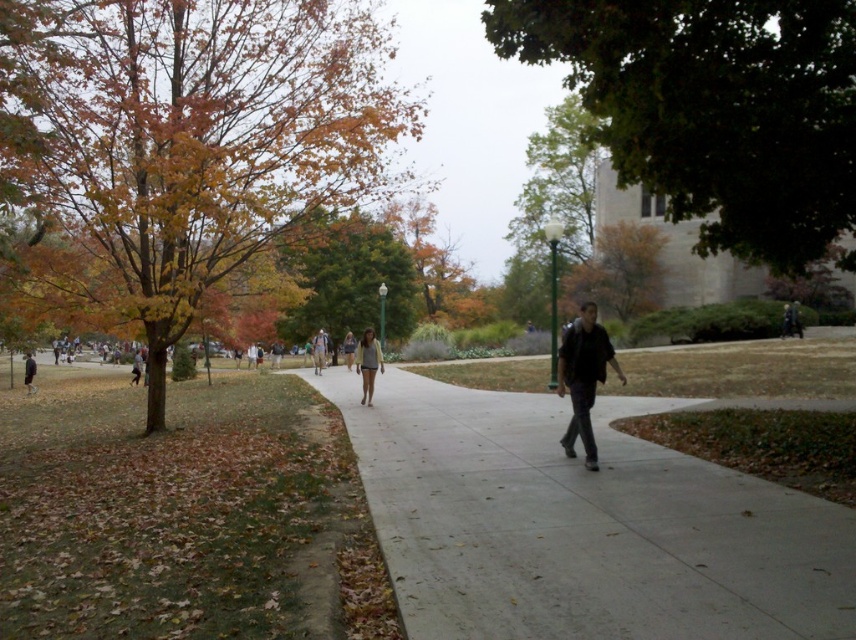
Question: Does dark brown leather jacket at center have a greater width compared to light beige sweater at center?

Choices:
 (A) yes
 (B) no

Answer: (A)

Question: Can you confirm if gray concrete sidewalk at center is positioned below dark brown leather jacket at center?

Choices:
 (A) no
 (B) yes

Answer: (B)

Question: Which of the following is the farthest from the observer?

Choices:
 (A) light beige sweater at center
 (B) autumn leaves at left
 (C) gray concrete sidewalk at center
 (D) light brown leather jacket at center

Answer: (D)

Question: Which point is farther from the camera taking this photo?

Choices:
 (A) (379, 412)
 (B) (403, 310)
 (C) (105, 186)

Answer: (B)

Question: Can you confirm if green leafy tree at center is wider than light beige sweater at center?

Choices:
 (A) no
 (B) yes

Answer: (B)

Question: Which object is closer to the camera taking this photo?

Choices:
 (A) autumn leaves at left
 (B) gray concrete sidewalk at center

Answer: (B)